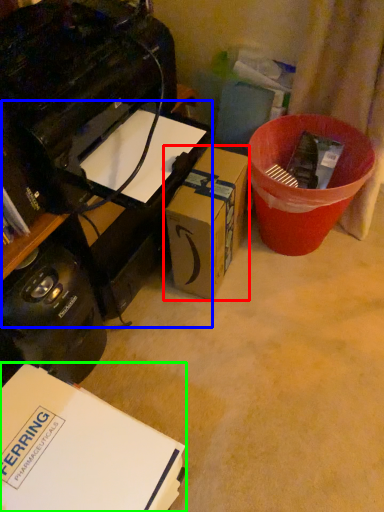
Question: Estimate the real-world distances between objects in this image. Which object is farther from box (highlighted by a red box), computer desk (highlighted by a blue box) or box (highlighted by a green box)?

Choices:
 (A) computer desk
 (B) box

Answer: (B)